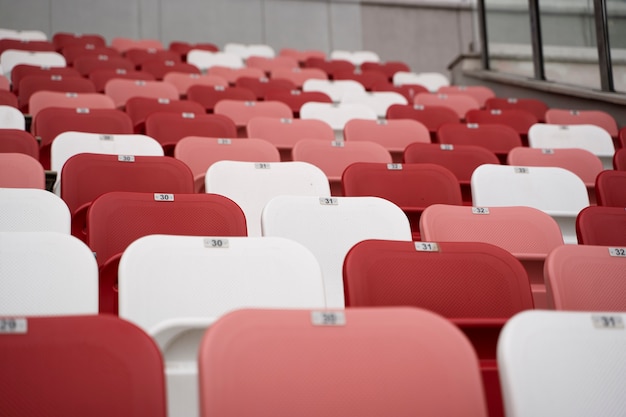
Find the location of a particular element. The image size is (626, 417). numbers on seats in first three rows is located at coordinates (217, 242), (424, 248), (618, 249), (607, 319), (327, 317), (13, 324), (163, 195), (332, 201), (481, 210).